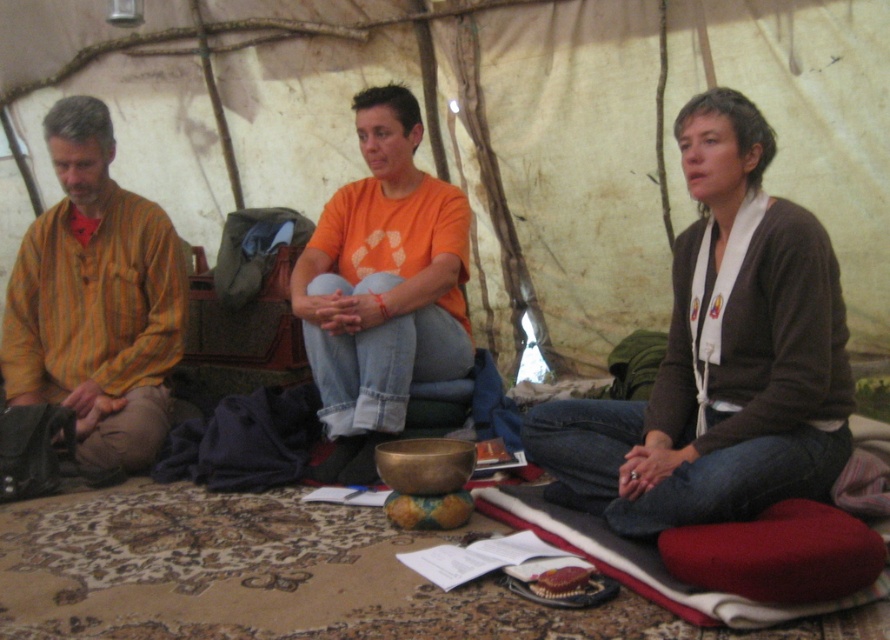
Question: Does brown cardigan at center appear on the right side of yellow striped fabric at left?

Choices:
 (A) yes
 (B) no

Answer: (A)

Question: Which of the following is the closest to the observer?

Choices:
 (A) brown cardigan at center
 (B) yellow striped fabric at left

Answer: (A)

Question: Which of these objects is positioned farthest from the orange cotton t-shirt at center?

Choices:
 (A) brown cardigan at center
 (B) yellow striped fabric at left

Answer: (A)

Question: In this image, where is brown cardigan at center located relative to yellow striped fabric at left?

Choices:
 (A) above
 (B) below

Answer: (B)

Question: Does brown cardigan at center have a larger size compared to orange cotton t-shirt at center?

Choices:
 (A) no
 (B) yes

Answer: (B)

Question: Which object is positioned closest to the brown cardigan at center?

Choices:
 (A) yellow striped fabric at left
 (B) orange cotton t-shirt at center

Answer: (B)